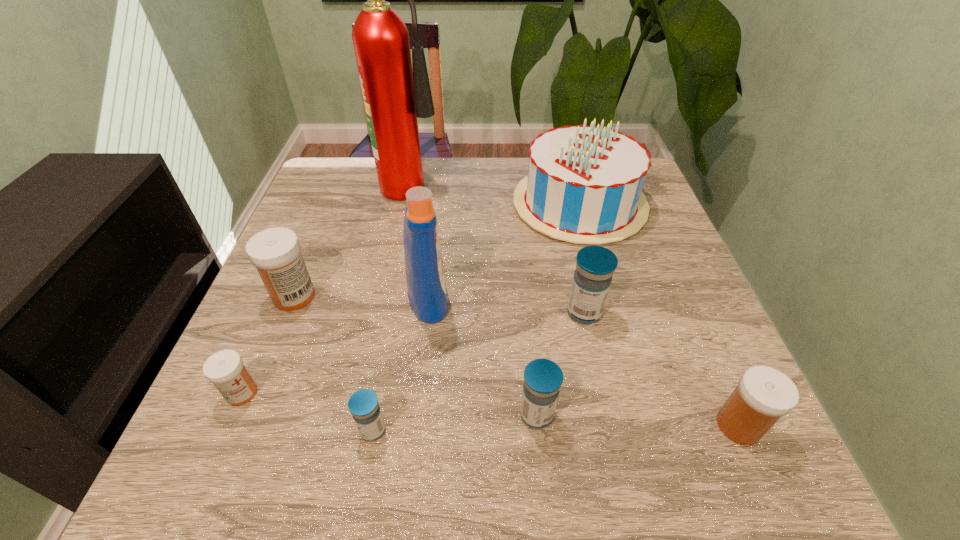
The height and width of the screenshot is (540, 960). What are the coordinates of `the second blue medicine from right to left` in the screenshot? It's located at (543, 378).

Find the location of `the second smallest blue medicine`. the second smallest blue medicine is located at coordinates (543, 378).

Find the location of `the smallest white medicine`. the smallest white medicine is located at coordinates (225, 369).

Find the location of `the leftmost blue medicine`. the leftmost blue medicine is located at coordinates (363, 404).

Where is `the fourth medicine from right to left`? This screenshot has height=540, width=960. the fourth medicine from right to left is located at coordinates (363, 404).

You are a GUI agent. You are given a task and a screenshot of the screen. Output one action in this format:
    pyautogui.click(x=<x>, y=<y>)
    Task: Click on the free spot located at the nozzle of the red fire extinguisher
    The width and height of the screenshot is (960, 540).
    Given the screenshot: What is the action you would take?
    pyautogui.click(x=477, y=181)

Identify the location of free space located on the label of the detergent. (619, 297).

The height and width of the screenshot is (540, 960). In order to click on free space located on the front of the seventh shortest object in this screenshot , I will do `click(612, 323)`.

You are a GUI agent. You are given a task and a screenshot of the screen. Output one action in this format:
    pyautogui.click(x=<x>, y=<y>)
    Task: Click on the vacant space located 0.110m on the back of the biggest white medicine
    This screenshot has height=540, width=960.
    Given the screenshot: What is the action you would take?
    pyautogui.click(x=314, y=247)

In order to click on vacant point located on the right of the farthest blue medicine in this screenshot , I will do `click(651, 313)`.